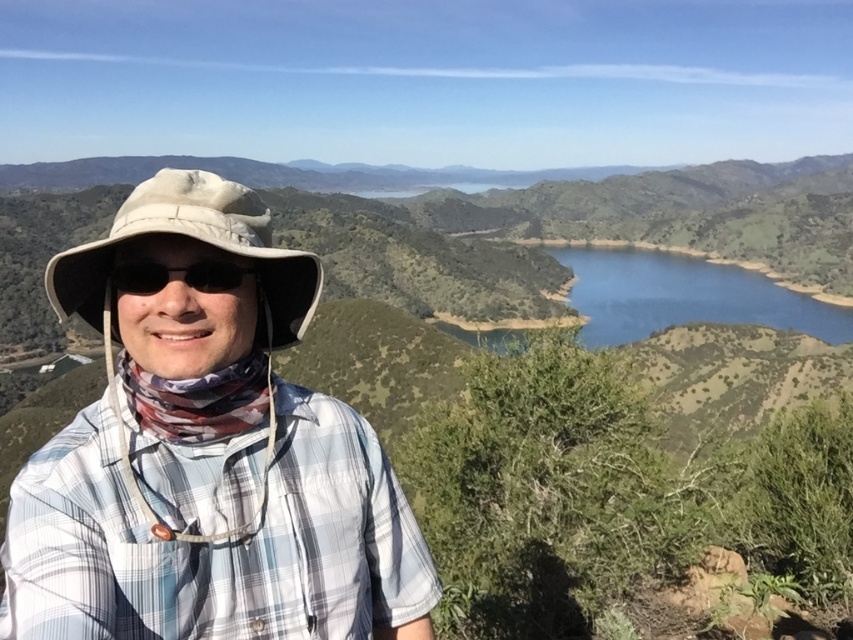
You are taking a photo of the person in the scene and want to focus on both the point at point (x=231, y=598) and the point at point (x=91, y=241). Which point should you adjust your focus to first if you want to ensure both are in focus?

You should focus on point (x=91, y=241) first because it is farther from the camera than point (x=231, y=598). By focusing on the farther point, the closer point will also be within the depth of field.

Based on the photo, you are a photographer capturing the scene described. You notice the tan fabric hat at center and the blue glossy water at center. Which object is positioned lower in the image?

The tan fabric hat at center is located below blue glossy water at center, so the tan fabric hat at center is positioned lower in the image.